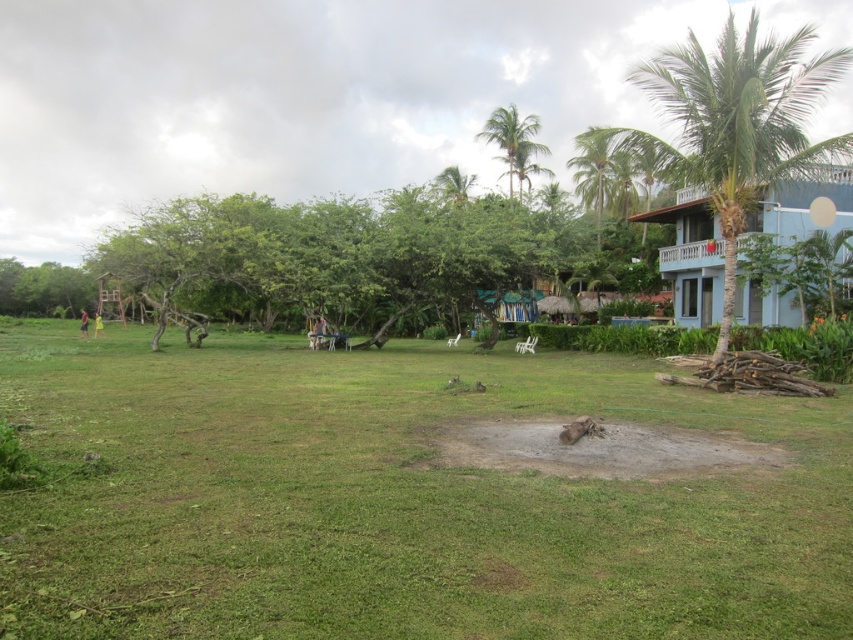
Between green grass at center and green grass at lower left, which one appears on the left side from the viewer's perspective?

green grass at lower left

Is green grass at center above green grass at lower left?

Incorrect, green grass at center is not positioned above green grass at lower left.

Between point (91, 545) and point (86, 333), which one is positioned behind?

Positioned behind is point (86, 333).

The image size is (853, 640). I want to click on green grass at center, so click(396, 499).

Does green grass at center have a greater width compared to green leafy palm tree at upper center?

Indeed, green grass at center has a greater width compared to green leafy palm tree at upper center.

Who is more distant from viewer, (422, 554) or (525, 115)?

Point (525, 115)

The width and height of the screenshot is (853, 640). In order to click on green grass at center in this screenshot , I will do `click(396, 499)`.

The height and width of the screenshot is (640, 853). I want to click on green grass at center, so click(x=396, y=499).

Which is more to the left, green leafy palm tree at upper center or green grass at lower left?

green grass at lower left is more to the left.

Can you confirm if green leafy palm tree at upper center is positioned below green grass at lower left?

Actually, green leafy palm tree at upper center is above green grass at lower left.

This screenshot has width=853, height=640. I want to click on green leafy palm tree at upper center, so click(x=512, y=138).